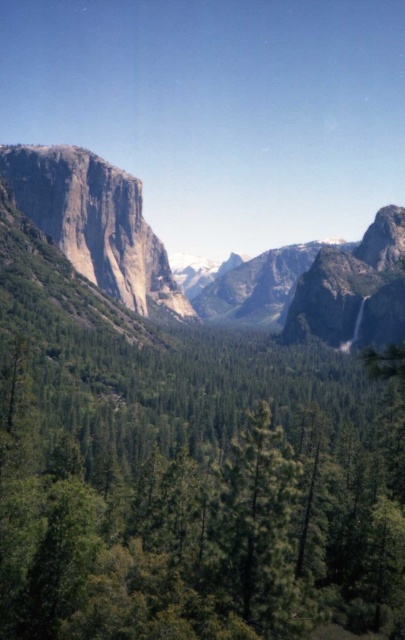
Question: Which of these objects is positioned closest to the rugged granite cliff at left?

Choices:
 (A) green matte tree at center
 (B) gray rock formation at left

Answer: (B)

Question: Which point is closer to the camera?

Choices:
 (A) (121, 225)
 (B) (4, 161)
 (C) (404, 508)

Answer: (C)

Question: Is gray rock formation at left further to camera compared to rugged granite cliff at left?

Choices:
 (A) no
 (B) yes

Answer: (B)

Question: Which of these objects is positioned closest to the rugged granite cliff at left?

Choices:
 (A) gray rock formation at left
 (B) green matte tree at center

Answer: (A)

Question: Is gray rock formation at left further to the viewer compared to rugged granite cliff at left?

Choices:
 (A) no
 (B) yes

Answer: (B)

Question: Where is green matte tree at center located in relation to rugged granite cliff at left in the image?

Choices:
 (A) above
 (B) below

Answer: (B)